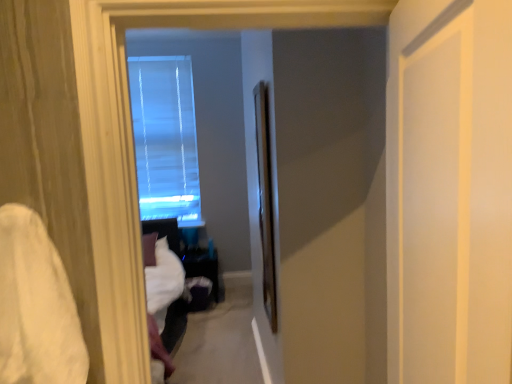
Identify the location of transparent glass window at center. (165, 137).

Is point (274, 283) positioned in front of point (40, 313)?

No, it is behind (40, 313).

Considering the sizes of objects clear glass screen door at center, acting as the 2th screen door starting from the right, and white soft fabric at left in the image provided, who is thinner, clear glass screen door at center, acting as the 2th screen door starting from the right, or white soft fabric at left?

clear glass screen door at center, acting as the 2th screen door starting from the right.

Between clear glass screen door at center, acting as the 2th screen door starting from the front, and white soft fabric at left, which one appears on the left side from the viewer's perspective?

white soft fabric at left.

Which object is further away from the camera, clear glass screen door at center, acting as the 2th screen door starting from the front, or white soft fabric at left?

clear glass screen door at center, acting as the 2th screen door starting from the front, is more distant.

Would you say white matte door at right, placed as the 1th screen door when sorted from right to left, is inside or outside transparent glass window at center?

white matte door at right, placed as the 1th screen door when sorted from right to left, exists outside the volume of transparent glass window at center.

Which of these two, white matte door at right, positioned as the 2th screen door in left-to-right order, or transparent glass window at center, is thinner?

With smaller width is transparent glass window at center.

How different are the orientations of white matte door at right, positioned as the second screen door in back-to-front order, and transparent glass window at center in degrees?

The facing directions of white matte door at right, positioned as the second screen door in back-to-front order, and transparent glass window at center are 102 degrees apart.

I want to click on window on the left of white matte door at right, positioned as the second screen door in back-to-front order, so click(x=165, y=137).

From the image's perspective, between transparent glass window at center and clear glass screen door at center, which ranks as the first screen door in left-to-right order, which one is located above?

From the image's view, transparent glass window at center is above.

Is transparent glass window at center oriented away from clear glass screen door at center, which ranks as the first screen door in left-to-right order?

No, transparent glass window at center is not facing the opposite direction of clear glass screen door at center, which ranks as the first screen door in left-to-right order.

Are transparent glass window at center and clear glass screen door at center, acting as the 2th screen door starting from the right, beside each other?

They are not placed beside each other.

Is the surface of transparent glass window at center in direct contact with white matte door at right, placed as the 1th screen door when sorted from right to left?

transparent glass window at center and white matte door at right, placed as the 1th screen door when sorted from right to left, are clearly separated.

From a real-world perspective, is transparent glass window at center above or below white matte door at right, positioned as the 2th screen door in left-to-right order?

transparent glass window at center is situated higher than white matte door at right, positioned as the 2th screen door in left-to-right order, in the real world.

Can you confirm if transparent glass window at center is smaller than white matte door at right, positioned as the second screen door in back-to-front order?

Yes, transparent glass window at center is smaller than white matte door at right, positioned as the second screen door in back-to-front order.

Is transparent glass window at center oriented towards white matte door at right, positioned as the second screen door in back-to-front order?

Yes.

Is white matte door at right, positioned as the 2th screen door in left-to-right order, wider or thinner than clear glass screen door at center, acting as the 2th screen door starting from the front?

Considering their sizes, white matte door at right, positioned as the 2th screen door in left-to-right order, looks broader than clear glass screen door at center, acting as the 2th screen door starting from the front.

Is point (507, 261) positioned behind point (270, 234)?

No, (507, 261) is in front of (270, 234).

Considering the relative sizes of white matte door at right, the first screen door from the front, and clear glass screen door at center, acting as the 2th screen door starting from the right, in the image provided, is white matte door at right, the first screen door from the front, shorter than clear glass screen door at center, acting as the 2th screen door starting from the right,?

Yes, white matte door at right, the first screen door from the front, is shorter than clear glass screen door at center, acting as the 2th screen door starting from the right.

What's the angular difference between white matte door at right, positioned as the second screen door in back-to-front order, and clear glass screen door at center, the first screen door positioned from the back,'s facing directions?

13.6 degrees.

From a real-world perspective, does white soft fabric at left stand above transparent glass window at center?

No, from a real-world perspective, white soft fabric at left is not over transparent glass window at center

Which object is further away from the camera taking this photo, white soft fabric at left or transparent glass window at center?

transparent glass window at center is behind.

Which of these two, white soft fabric at left or transparent glass window at center, is bigger?

transparent glass window at center.

Would you say white soft fabric at left is a long distance from transparent glass window at center?

Yes, white soft fabric at left and transparent glass window at center are located far from each other.

Considering the relative sizes of white matte door at right, placed as the 1th screen door when sorted from right to left, and white soft fabric at left in the image provided, is white matte door at right, placed as the 1th screen door when sorted from right to left, wider than white soft fabric at left?

Yes, white matte door at right, placed as the 1th screen door when sorted from right to left, is wider than white soft fabric at left.

From the white soft fabric at left, count 2nd screen door to the right and point to it. Please provide its 2D coordinates.

[(449, 192)]

Looking at this image, from the image's perspective, between white matte door at right, the first screen door from the front, and white soft fabric at left, which one is located above?

From the image's view, white matte door at right, the first screen door from the front, is above.

Considering the relative sizes of white matte door at right, the first screen door from the front, and white soft fabric at left in the image provided, is white matte door at right, the first screen door from the front, smaller than white soft fabric at left?

No.

You are a GUI agent. You are given a task and a screenshot of the screen. Output one action in this format:
    pyautogui.click(x=<x>, y=<y>)
    Task: Click on the sheet located below the clear glass screen door at center, the first screen door positioned from the back (from the image's perspective)
    
    Given the screenshot: What is the action you would take?
    pyautogui.click(x=36, y=306)

Find the location of `window on the left of white matte door at right, positioned as the second screen door in back-to-front order`. window on the left of white matte door at right, positioned as the second screen door in back-to-front order is located at coordinates (165, 137).

Looking at the image, which one is located further to clear glass screen door at center, acting as the 2th screen door starting from the right, white soft fabric at left or transparent glass window at center?

transparent glass window at center is positioned further to the anchor clear glass screen door at center, acting as the 2th screen door starting from the right.

Estimate the real-world distances between objects in this image. Which object is closer to white soft fabric at left, clear glass screen door at center, acting as the 2th screen door starting from the right, or transparent glass window at center?

Based on the image, clear glass screen door at center, acting as the 2th screen door starting from the right, appears to be nearer to white soft fabric at left.

In the scene shown: From the image, which object appears to be farther from white matte door at right, the first screen door from the front, clear glass screen door at center, acting as the 2th screen door starting from the right, or white soft fabric at left?

Based on the image, clear glass screen door at center, acting as the 2th screen door starting from the right, appears to be further to white matte door at right, the first screen door from the front.

Which object lies nearer to the anchor point white soft fabric at left, white matte door at right, positioned as the 2th screen door in left-to-right order, or clear glass screen door at center, which ranks as the first screen door in left-to-right order?

white matte door at right, positioned as the 2th screen door in left-to-right order.

From the image, which object appears to be farther from white soft fabric at left, white matte door at right, positioned as the 2th screen door in left-to-right order, or transparent glass window at center?

transparent glass window at center is further to white soft fabric at left.

Based on their spatial positions, is transparent glass window at center or white soft fabric at left closer to white matte door at right, positioned as the 2th screen door in left-to-right order?

The object closer to white matte door at right, positioned as the 2th screen door in left-to-right order, is white soft fabric at left.

Based on their spatial positions, is white matte door at right, the first screen door from the front, or white soft fabric at left closer to clear glass screen door at center, the first screen door positioned from the back?

white soft fabric at left is positioned closer to the anchor clear glass screen door at center, the first screen door positioned from the back.

Which object lies nearer to the anchor point white soft fabric at left, transparent glass window at center or clear glass screen door at center, which ranks as the first screen door in left-to-right order?

clear glass screen door at center, which ranks as the first screen door in left-to-right order, is closer to white soft fabric at left.

At what (x,y) coordinates should I click in order to perform the action: click on sheet between white matte door at right, positioned as the 2th screen door in left-to-right order, and transparent glass window at center from front to back. Please return your answer as a coordinate pair (x, y). Looking at the image, I should click on (36, 306).

Image resolution: width=512 pixels, height=384 pixels. I want to click on screen door between white matte door at right, placed as the 1th screen door when sorted from right to left, and transparent glass window at center from front to back, so click(265, 202).

The height and width of the screenshot is (384, 512). Find the location of `screen door between white soft fabric at left and transparent glass window at center along the z-axis`. screen door between white soft fabric at left and transparent glass window at center along the z-axis is located at coordinates (265, 202).

Locate an element on the screen. sheet between white matte door at right, positioned as the 2th screen door in left-to-right order, and clear glass screen door at center, which ranks as the first screen door in left-to-right order, along the z-axis is located at coordinates (36, 306).